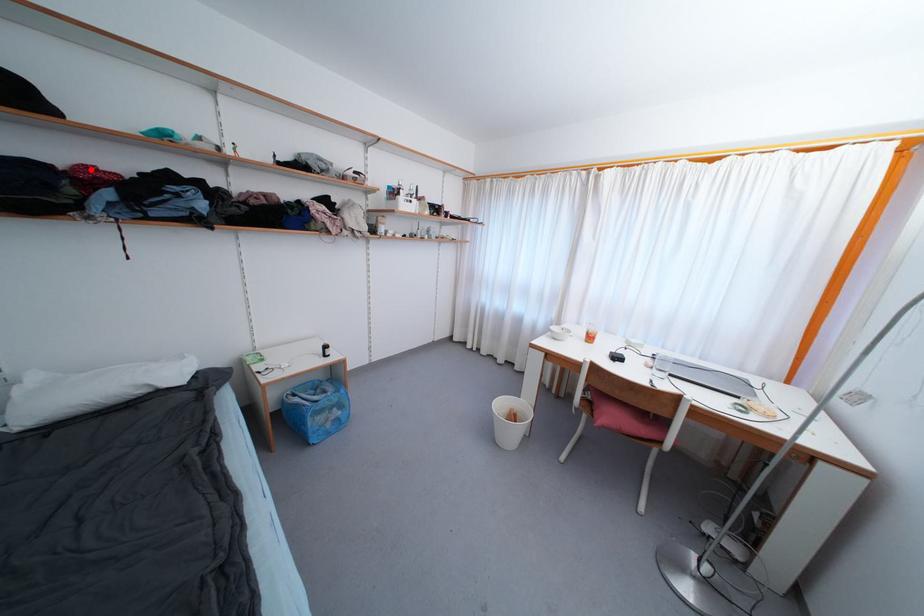
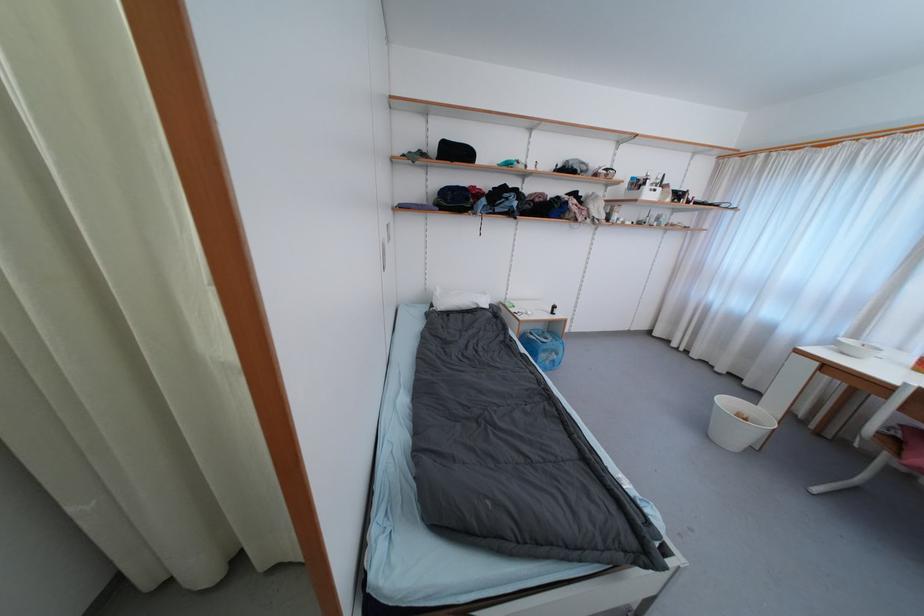
Question: I am providing you with two images of the same scene from different viewpoints. A red point is shown in image1. For the corresponding object point in image2, is it positioned nearer or farther from the camera?

Choices:
 (A) Nearer
 (B) Farther

Answer: (A)